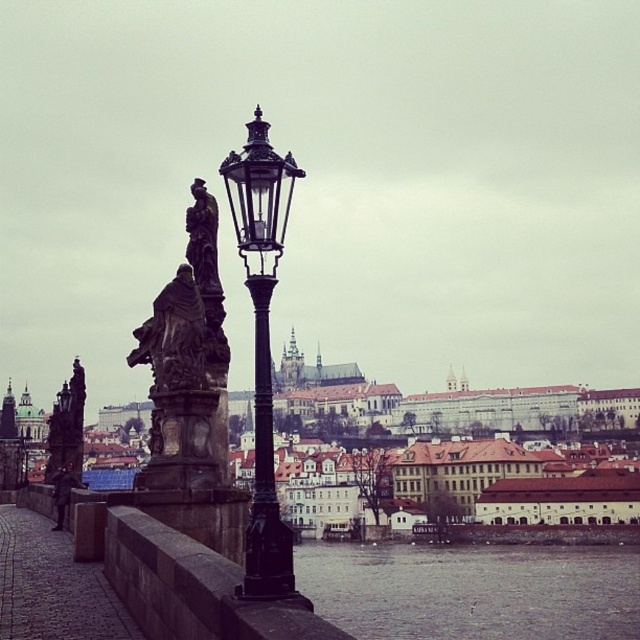
Based on the photo, you are standing on the bridge and want to take a photo of the gray water at lower center and the black metal pole at center. Which object will appear smaller in your photo?

The gray water at lower center will appear smaller in the photo because it is smaller than the black metal pole at center.

You are a tourist standing on the bridge and want to take a photo of both the black metal pole at center and the dark brown stone statue at center. Which object should you focus on first if you want to capture both in the same frame without moving your camera?

You should focus on the black metal pole at center first because it is larger in size than the dark brown stone statue at center, so it will take up more space in the frame and ensure both are included.